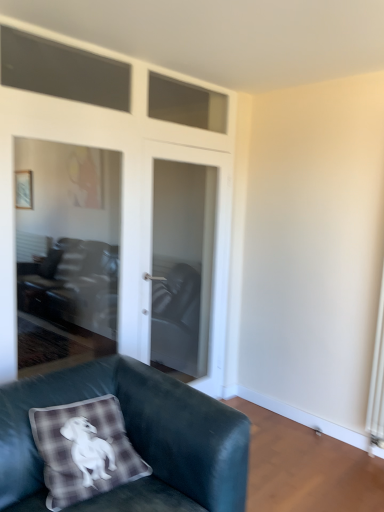
Image resolution: width=384 pixels, height=512 pixels. I want to click on white glossy door at center, so click(196, 246).

What do you see at coordinates (196, 246) in the screenshot? I see `white glossy door at center` at bounding box center [196, 246].

The width and height of the screenshot is (384, 512). What do you see at coordinates (133, 438) in the screenshot?
I see `velvet dark green couch at lower left` at bounding box center [133, 438].

Locate an element on the screen. The width and height of the screenshot is (384, 512). velvet dark green couch at lower left is located at coordinates (133, 438).

Identify the location of white glossy door at center. Image resolution: width=384 pixels, height=512 pixels. (196, 246).

Based on their positions, is white glossy door at center located to the left or right of velvet dark green couch at lower left?

In the image, white glossy door at center appears on the right side of velvet dark green couch at lower left.

Considering the relative positions of white glossy door at center and velvet dark green couch at lower left in the image provided, is white glossy door at center behind velvet dark green couch at lower left?

Yes, it is behind velvet dark green couch at lower left.

Is point (198, 222) behind point (244, 431)?

Yes.

Based on the photo, from the image's perspective, is white glossy door at center positioned above or below velvet dark green couch at lower left?

white glossy door at center is situated higher than velvet dark green couch at lower left in the image.

Based on the photo, from a real-world perspective, relative to velvet dark green couch at lower left, is white glossy door at center vertically above or below?

white glossy door at center is above velvet dark green couch at lower left.

Does white glossy door at center have a lesser width compared to velvet dark green couch at lower left?

Indeed, white glossy door at center has a lesser width compared to velvet dark green couch at lower left.

In terms of height, does white glossy door at center look taller or shorter compared to velvet dark green couch at lower left?

white glossy door at center is taller than velvet dark green couch at lower left.

Is white glossy door at center smaller than velvet dark green couch at lower left?

Yes.

Is white glossy door at center spatially inside velvet dark green couch at lower left, or outside of it?

white glossy door at center is spatially situated outside velvet dark green couch at lower left.

Does white glossy door at center touch velvet dark green couch at lower left?

No, white glossy door at center is not making contact with velvet dark green couch at lower left.

Is white glossy door at center looking in the opposite direction of velvet dark green couch at lower left?

white glossy door at center does not have its back to velvet dark green couch at lower left.

Measure the distance from white glossy door at center to velvet dark green couch at lower left.

The distance of white glossy door at center from velvet dark green couch at lower left is 4.90 feet.

This screenshot has width=384, height=512. I want to click on screen door that is behind the velvet dark green couch at lower left, so click(x=196, y=246).

Is velvet dark green couch at lower left to the left of white glossy door at center from the viewer's perspective?

Result: Correct, you'll find velvet dark green couch at lower left to the left of white glossy door at center.

In the image, is velvet dark green couch at lower left positioned in front of or behind white glossy door at center?

Visually, velvet dark green couch at lower left is located in front of white glossy door at center.

Is point (230, 490) less distant than point (216, 155)?

Yes.

From the image's perspective, would you say velvet dark green couch at lower left is positioned over white glossy door at center?

No, from the image's perspective, velvet dark green couch at lower left is not on top of white glossy door at center.

From a real-world perspective, which is physically below, velvet dark green couch at lower left or white glossy door at center?

From a 3D spatial view, velvet dark green couch at lower left is below.

Which object is wider, velvet dark green couch at lower left or white glossy door at center?

Wider between the two is velvet dark green couch at lower left.

Considering the relative sizes of velvet dark green couch at lower left and white glossy door at center in the image provided, is velvet dark green couch at lower left shorter than white glossy door at center?

Yes.

Which of these two, velvet dark green couch at lower left or white glossy door at center, is smaller?

white glossy door at center is smaller.

In the scene shown: Is velvet dark green couch at lower left spatially inside white glossy door at center, or outside of it?

velvet dark green couch at lower left is spatially situated outside white glossy door at center.

Would you say velvet dark green couch at lower left is a long distance from white glossy door at center?

Yes, velvet dark green couch at lower left is far from white glossy door at center.

Is velvet dark green couch at lower left oriented away from white glossy door at center?

velvet dark green couch at lower left does not have its back to white glossy door at center.

What's the angular difference between velvet dark green couch at lower left and white glossy door at center's facing directions?

velvet dark green couch at lower left and white glossy door at center are facing 0.0604 degrees away from each other.

The width and height of the screenshot is (384, 512). Identify the location of studio couch below the white glossy door at center (from the image's perspective). (133, 438).

Find the location of `screen door behind the velvet dark green couch at lower left`. screen door behind the velvet dark green couch at lower left is located at coordinates (196, 246).

Find the location of a particular element. The width and height of the screenshot is (384, 512). studio couch lying on the left of white glossy door at center is located at coordinates (133, 438).